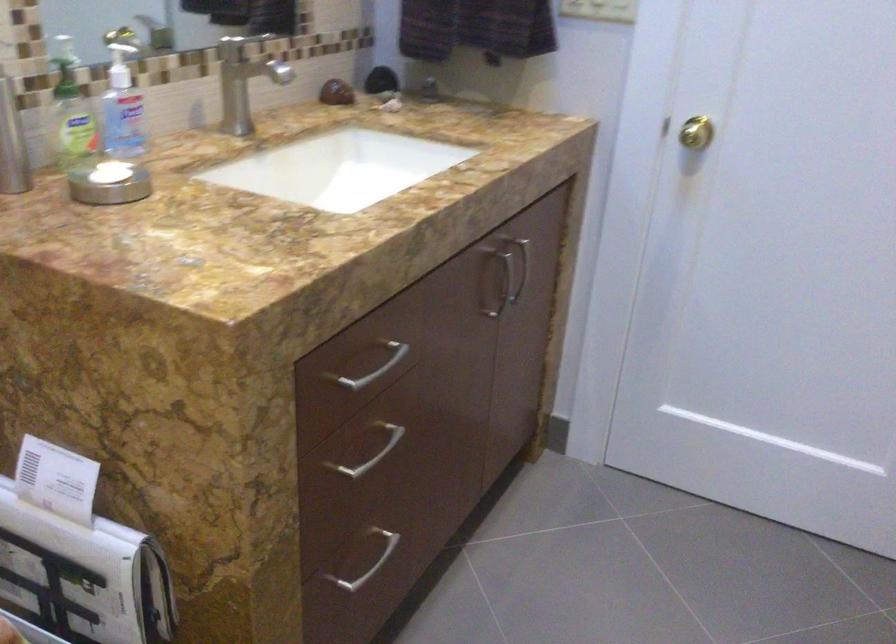
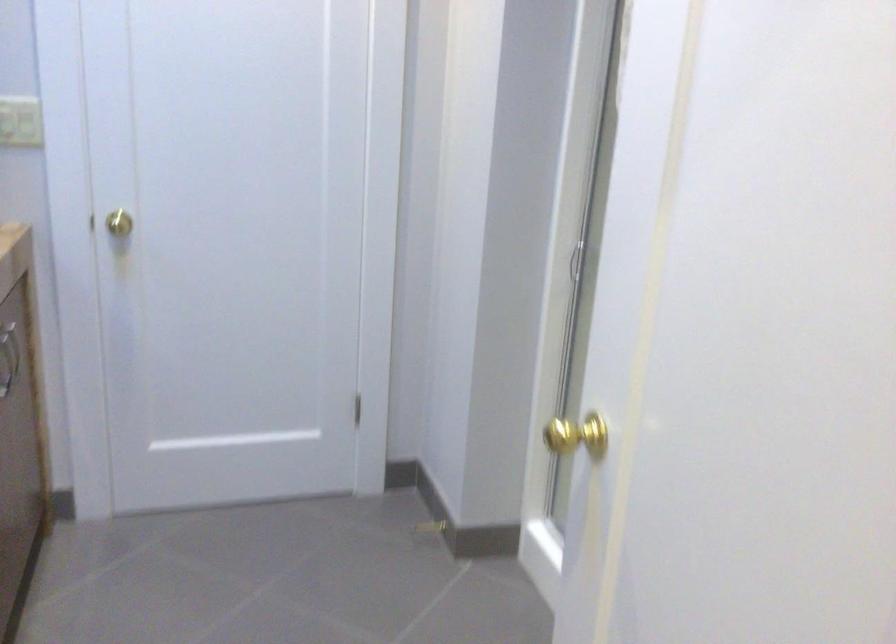
Question: The camera is either moving clockwise (left) or counter-clockwise (right) around the object. The first image is from the beginning of the video and the second image is from the end. Is the camera moving left or right when shooting the video?

Choices:
 (A) Left
 (B) Right

Answer: (A)